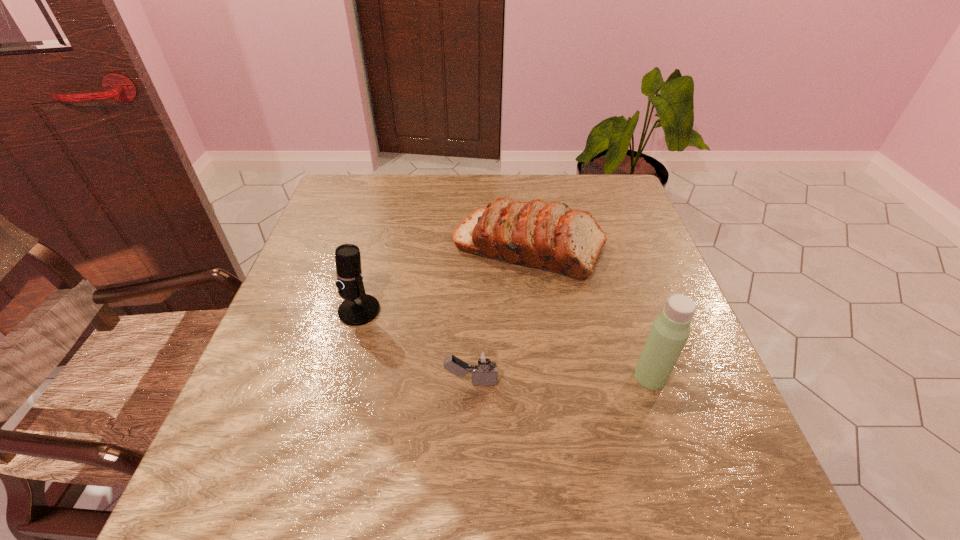
I want to click on object present at the left edge, so click(x=358, y=308).

Where is `thermos bottle located at the right edge`? This screenshot has width=960, height=540. thermos bottle located at the right edge is located at coordinates (670, 330).

Where is `bread present at the right edge`? bread present at the right edge is located at coordinates (552, 237).

Identify the location of object that is at the far right corner. The width and height of the screenshot is (960, 540). (552, 237).

Where is `vacant space at the far edge of the desktop`? vacant space at the far edge of the desktop is located at coordinates (407, 194).

Find the location of `free space at the near edge of the desktop`. free space at the near edge of the desktop is located at coordinates (525, 470).

The width and height of the screenshot is (960, 540). In the image, there is a desktop. Find the location of `free space at the left edge`. free space at the left edge is located at coordinates (214, 444).

This screenshot has width=960, height=540. In the image, there is a desktop. What are the coordinates of `vacant space at the right edge` in the screenshot? It's located at (639, 260).

This screenshot has width=960, height=540. Find the location of `free space at the far left corner of the desktop`. free space at the far left corner of the desktop is located at coordinates (379, 176).

What are the coordinates of `free space at the near right corner of the desktop` in the screenshot? It's located at (711, 514).